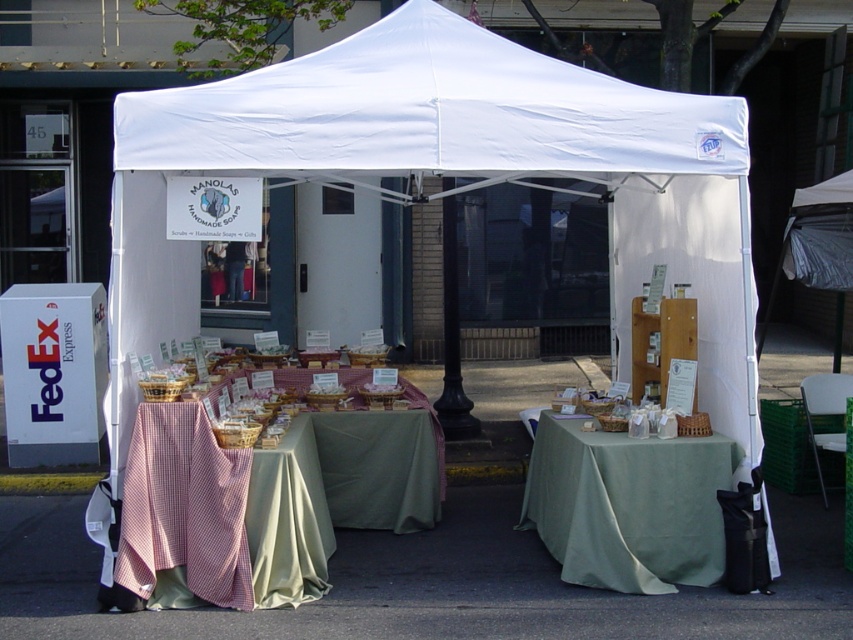
Does white fabric canopy at upper center appear on the left side of green fabric table at center?

Yes, white fabric canopy at upper center is to the left of green fabric table at center.

Who is more distant from viewer, (x=229, y=102) or (x=554, y=554)?

Positioned behind is point (x=554, y=554).

Locate an element on the screen. white fabric canopy at upper center is located at coordinates (428, 115).

Based on the photo, does white fabric canopy at upper center appear over checkered fabric table at center?

Yes, white fabric canopy at upper center is above checkered fabric table at center.

Does white fabric canopy at upper center have a greater width compared to checkered fabric table at center?

Indeed, white fabric canopy at upper center has a greater width compared to checkered fabric table at center.

Where is `white fabric canopy at upper center`? This screenshot has width=853, height=640. white fabric canopy at upper center is located at coordinates (428, 115).

Can you confirm if checkered fabric table at center is shorter than green fabric table at center?

Incorrect, checkered fabric table at center's height does not fall short of green fabric table at center's.

Who is more forward, [358,506] or [717,465]?

Point [717,465] is more forward.

What do you see at coordinates (268, 500) in the screenshot? I see `checkered fabric table at center` at bounding box center [268, 500].

Image resolution: width=853 pixels, height=640 pixels. I want to click on checkered fabric table at center, so click(268, 500).